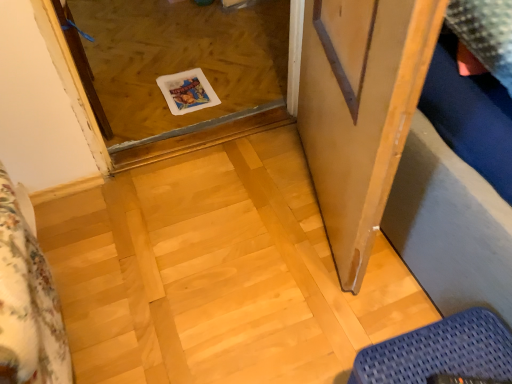
Question: Considering the positions of point (423, 380) and point (332, 231), is point (423, 380) closer or farther from the camera than point (332, 231)?

Choices:
 (A) farther
 (B) closer

Answer: (B)

Question: From a real-world perspective, is blue woven mat at lower right above or below wooden screen door at right?

Choices:
 (A) above
 (B) below

Answer: (B)

Question: Considering the real-world distances, which object is closest to the blue woven mat at lower right?

Choices:
 (A) wooden screen door at right
 (B) transparent glass door at center

Answer: (A)

Question: Estimate the real-world distances between objects in this image. Which object is closer to the transparent glass door at center?

Choices:
 (A) blue woven mat at lower right
 (B) wooden screen door at right

Answer: (B)